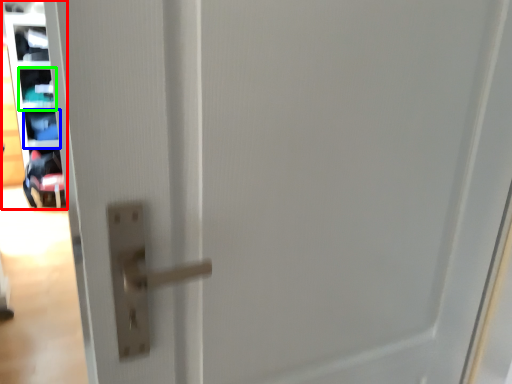
Question: Which is nearer to the shelf (highlighted by a red box)? shelf (highlighted by a blue box) or shelf (highlighted by a green box).

Choices:
 (A) shelf
 (B) shelf

Answer: (B)